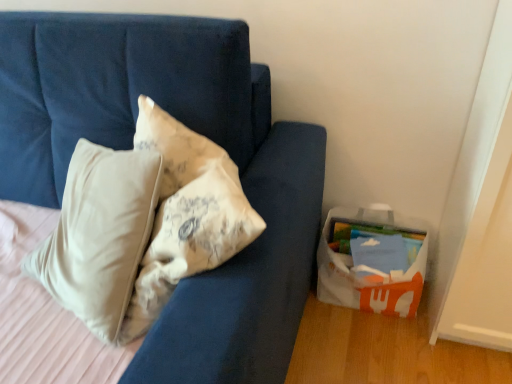
Question: From the image's perspective, would you say blue fabric couch at center is shown under white plastic basket at lower right?

Choices:
 (A) yes
 (B) no

Answer: (B)

Question: Considering the relative sizes of blue fabric couch at center and white plastic basket at lower right in the image provided, is blue fabric couch at center thinner than white plastic basket at lower right?

Choices:
 (A) no
 (B) yes

Answer: (A)

Question: Is blue fabric couch at center taller than white plastic basket at lower right?

Choices:
 (A) no
 (B) yes

Answer: (B)

Question: Is the surface of blue fabric couch at center in direct contact with white plastic basket at lower right?

Choices:
 (A) no
 (B) yes

Answer: (A)

Question: Is blue fabric couch at center at the right side of white plastic basket at lower right?

Choices:
 (A) no
 (B) yes

Answer: (A)

Question: Is blue fabric couch at center positioned behind white plastic basket at lower right?

Choices:
 (A) no
 (B) yes

Answer: (A)

Question: From the image's perspective, would you say white plastic basket at lower right is shown under blue fabric couch at center?

Choices:
 (A) yes
 (B) no

Answer: (A)

Question: Can you confirm if white plastic basket at lower right is bigger than blue fabric couch at center?

Choices:
 (A) yes
 (B) no

Answer: (B)

Question: Considering the relative sizes of white plastic basket at lower right and blue fabric couch at center in the image provided, is white plastic basket at lower right shorter than blue fabric couch at center?

Choices:
 (A) no
 (B) yes

Answer: (B)

Question: Would you say white plastic basket at lower right is a long distance from blue fabric couch at center?

Choices:
 (A) yes
 (B) no

Answer: (B)

Question: Does white plastic basket at lower right come in front of blue fabric couch at center?

Choices:
 (A) no
 (B) yes

Answer: (A)

Question: From the image's perspective, is white plastic basket at lower right on blue fabric couch at center?

Choices:
 (A) no
 (B) yes

Answer: (A)

Question: Considering the positions of blue fabric couch at center and white plastic basket at lower right in the image, is blue fabric couch at center bigger or smaller than white plastic basket at lower right?

Choices:
 (A) big
 (B) small

Answer: (A)